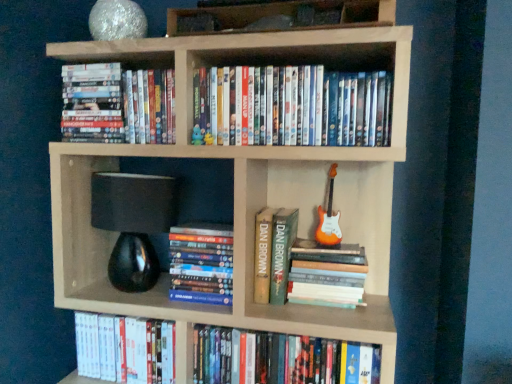
Question: From the image's perspective, is matte blue plush toy at upper center under wooden books at upper center?

Choices:
 (A) no
 (B) yes

Answer: (B)

Question: Is matte blue plush toy at upper center at the right side of wooden books at upper center?

Choices:
 (A) yes
 (B) no

Answer: (B)

Question: Is matte blue plush toy at upper center smaller than wooden books at upper center?

Choices:
 (A) no
 (B) yes

Answer: (B)

Question: Could you tell me if matte blue plush toy at upper center is facing wooden books at upper center?

Choices:
 (A) no
 (B) yes

Answer: (A)

Question: Is wooden books at upper center surrounded by matte blue plush toy at upper center?

Choices:
 (A) no
 (B) yes

Answer: (A)

Question: Considering the positions of hardcover book at lower center, which ranks as the seventh book in top-to-bottom order, and white glossy dvds at upper left, positioned as the 7th book in bottom-to-top order, in the image, is hardcover book at lower center, which ranks as the seventh book in top-to-bottom order, taller or shorter than white glossy dvds at upper left, positioned as the 7th book in bottom-to-top order,?

Choices:
 (A) tall
 (B) short

Answer: (A)

Question: Is hardcover book at lower center, the first book positioned from the bottom, situated inside white glossy dvds at upper left, positioned as the 7th book in bottom-to-top order, or outside?

Choices:
 (A) outside
 (B) inside

Answer: (A)

Question: In the image, is hardcover book at lower center, which ranks as the seventh book in top-to-bottom order, positioned in front of or behind white glossy dvds at upper left, positioned as the 1th book in top-to-bottom order?

Choices:
 (A) behind
 (B) front

Answer: (B)

Question: From the image's perspective, relative to white glossy dvds at upper left, positioned as the 7th book in bottom-to-top order, is hardcover book at lower center, the first book positioned from the bottom, above or below?

Choices:
 (A) above
 (B) below

Answer: (B)

Question: From the image's perspective, is orange glossy electric guitar at right positioned above or below green hardcover book at center, which appears as the fifth book when ordered from the bottom?

Choices:
 (A) above
 (B) below

Answer: (A)

Question: In terms of height, does orange glossy electric guitar at right look taller or shorter compared to green hardcover book at center, which appears as the fifth book when ordered from the bottom?

Choices:
 (A) tall
 (B) short

Answer: (A)

Question: Based on their positions, is orange glossy electric guitar at right located to the left or right of green hardcover book at center, which appears as the fifth book when ordered from the bottom?

Choices:
 (A) right
 (B) left

Answer: (A)

Question: Considering the positions of point (330, 236) and point (285, 256), is point (330, 236) closer or farther from the camera than point (285, 256)?

Choices:
 (A) farther
 (B) closer

Answer: (A)

Question: Is white glossy dvds at upper left, positioned as the 7th book in bottom-to-top order, in front of or behind hardcover books at center, arranged as the 4th book when viewed from the top, in the image?

Choices:
 (A) front
 (B) behind

Answer: (A)

Question: Looking at their shapes, would you say white glossy dvds at upper left, positioned as the 7th book in bottom-to-top order, is wider or thinner than hardcover books at center, arranged as the 4th book when viewed from the top?

Choices:
 (A) wide
 (B) thin

Answer: (A)